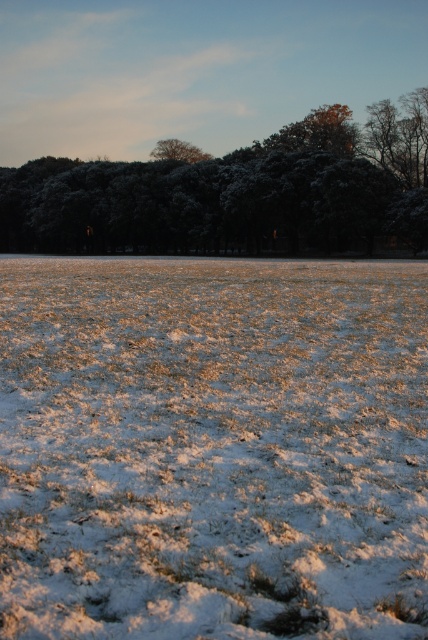
Question: Can you confirm if snow-covered trees at upper center is positioned to the right of snow-covered tree at upper center?

Choices:
 (A) no
 (B) yes

Answer: (B)

Question: Can you confirm if snow-covered trees at upper center is positioned to the left of snow-covered tree at upper center?

Choices:
 (A) no
 (B) yes

Answer: (A)

Question: Which object appears farthest from the camera in this image?

Choices:
 (A) snow-covered tree at upper center
 (B) snow-covered trees at upper center

Answer: (A)

Question: Can you confirm if snow-covered trees at upper center is thinner than snow-covered tree at upper center?

Choices:
 (A) no
 (B) yes

Answer: (A)